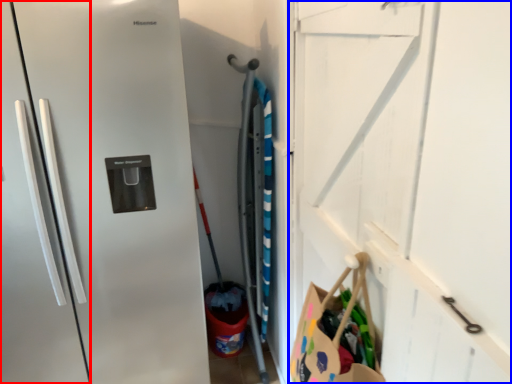
Question: Which object is further to the camera taking this photo, door (highlighted by a red box) or garage door (highlighted by a blue box)?

Choices:
 (A) door
 (B) garage door

Answer: (B)